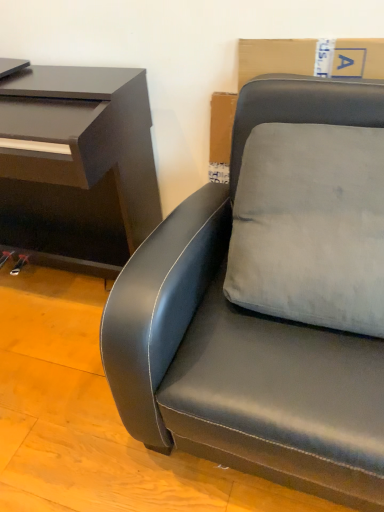
The height and width of the screenshot is (512, 384). Identify the location of gray fabric pillow at center. (310, 226).

Image resolution: width=384 pixels, height=512 pixels. Describe the element at coordinates (310, 226) in the screenshot. I see `gray fabric pillow at center` at that location.

Measure the distance between point (331, 227) and camera.

Point (331, 227) is 36.69 inches away from camera.

This screenshot has height=512, width=384. What are the coordinates of `gray fabric pillow at center` in the screenshot? It's located at (310, 226).